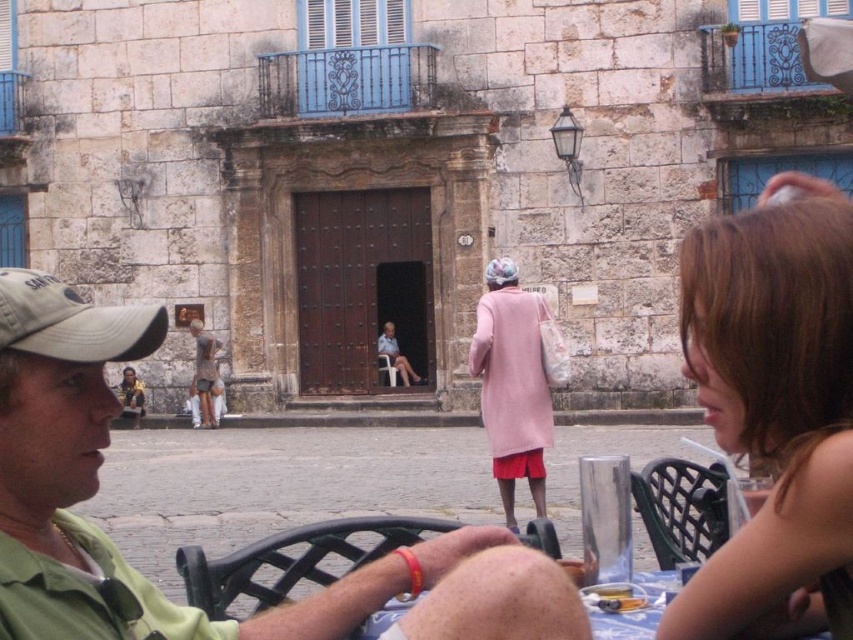
Is point (824, 349) behind point (540, 420)?

No, it is in front of (540, 420).

How far apart are brown hair at upper right and pink fabric coat at center?

13.91 meters

Image resolution: width=853 pixels, height=640 pixels. What do you see at coordinates (775, 408) in the screenshot? I see `brown hair at upper right` at bounding box center [775, 408].

Locate an element on the screen. brown hair at upper right is located at coordinates (775, 408).

Is green fabric shirt at lower left shorter than tan fabric baseball cap at left?

In fact, green fabric shirt at lower left may be taller than tan fabric baseball cap at left.

Who is lower down, green fabric shirt at lower left or tan fabric baseball cap at left?

green fabric shirt at lower left is lower down.

What are the coordinates of `green fabric shirt at lower left` in the screenshot? It's located at (143, 577).

Which is in front, point (785, 264) or point (50, 292)?

Positioned in front is point (785, 264).

How much distance is there between brown hair at upper right and tan fabric baseball cap at left?

They are 10.89 meters apart.

Which is in front, point (839, 307) or point (57, 356)?

Point (839, 307) is more forward.

The height and width of the screenshot is (640, 853). I want to click on brown hair at upper right, so click(775, 408).